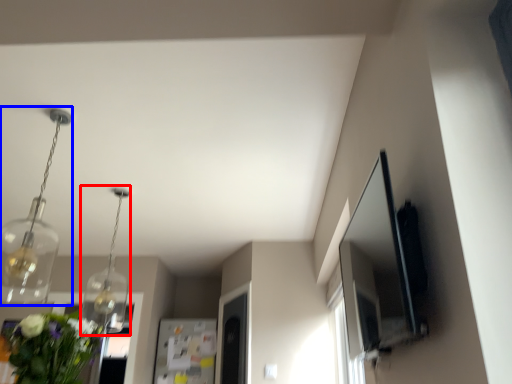
Question: Which object appears closest to the camera in this image, light fixture (highlighted by a red box) or light fixture (highlighted by a blue box)?

Choices:
 (A) light fixture
 (B) light fixture

Answer: (B)